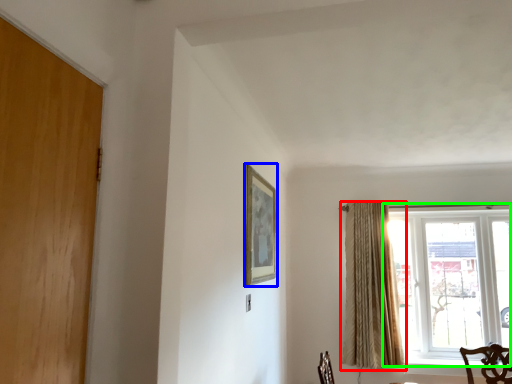
Question: Which object is the farthest from curtain (highlighted by a red box)? Choose among these: picture frame (highlighted by a blue box) or window (highlighted by a green box).

Choices:
 (A) picture frame
 (B) window

Answer: (A)